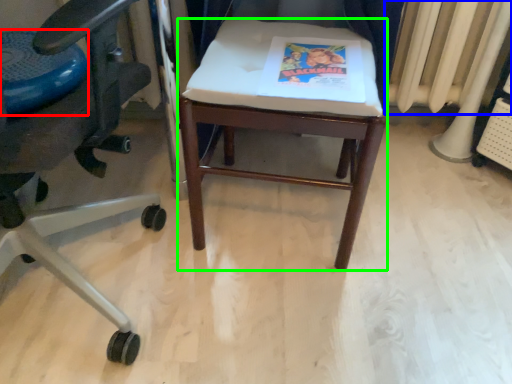
Question: Considering the real-world distances, which object is closest to round table (highlighted by a red box)? radiator (highlighted by a blue box) or stool (highlighted by a green box).

Choices:
 (A) radiator
 (B) stool

Answer: (B)